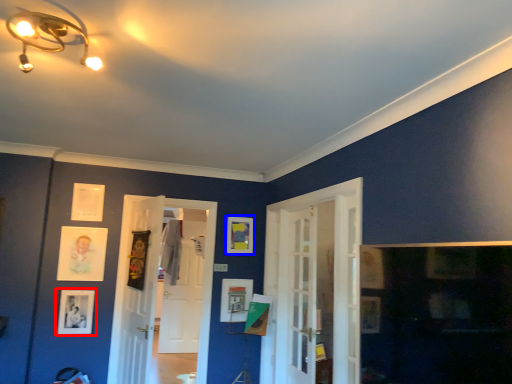
Question: Which object is closer to the camera taking this photo, picture frame (highlighted by a red box) or picture frame (highlighted by a blue box)?

Choices:
 (A) picture frame
 (B) picture frame

Answer: (A)